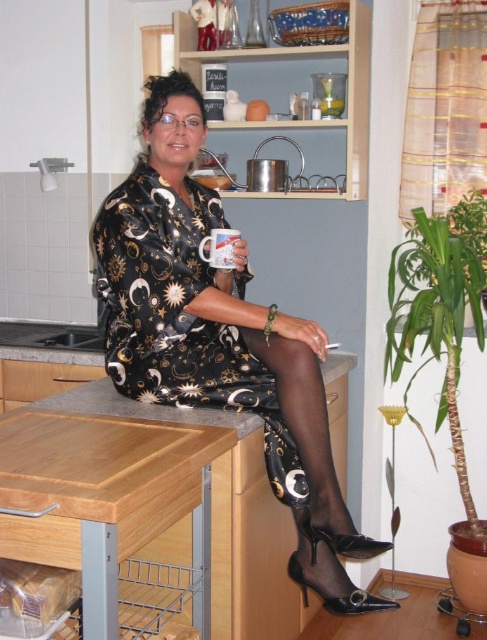
Question: Can you confirm if metallic dress at center is positioned to the right of white ceramic mug at center?

Choices:
 (A) no
 (B) yes

Answer: (A)

Question: Which point is farther from the camera taking this photo?

Choices:
 (A) (280, 440)
 (B) (220, 244)

Answer: (B)

Question: Can you confirm if metallic dress at center is smaller than white ceramic mug at center?

Choices:
 (A) yes
 (B) no

Answer: (B)

Question: Does metallic dress at center come behind white ceramic mug at center?

Choices:
 (A) no
 (B) yes

Answer: (A)